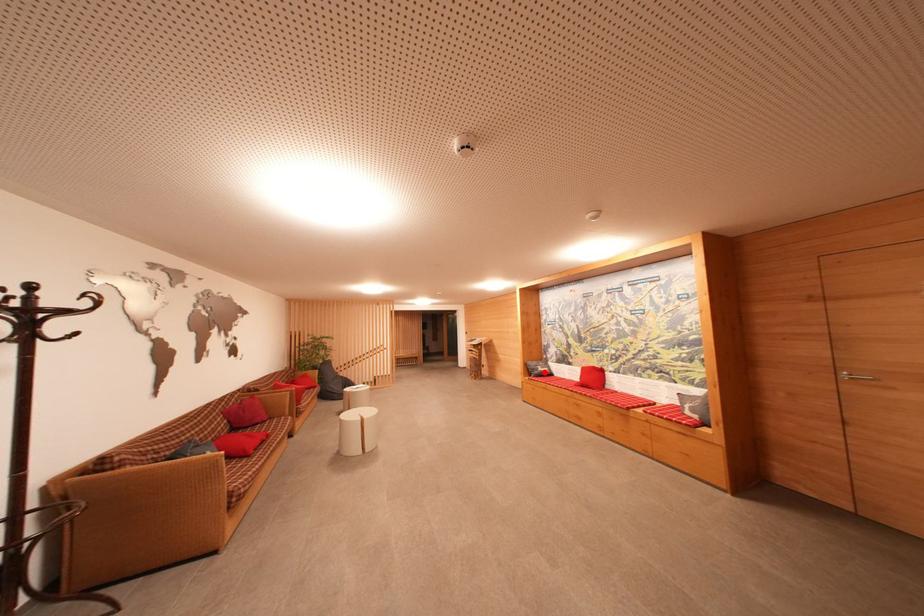
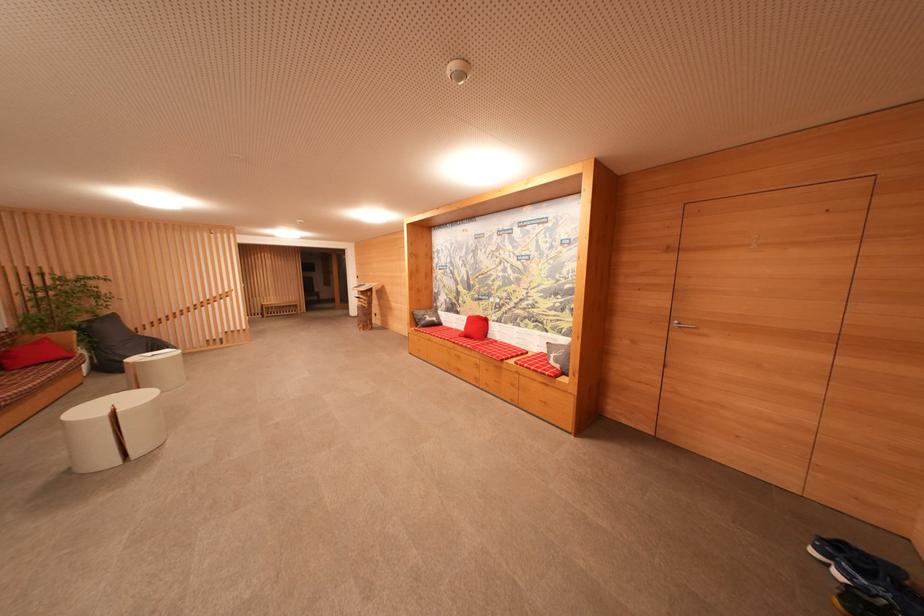
In the second image, find the point that corresponds to the highlighted location in the first image.

(432, 322)